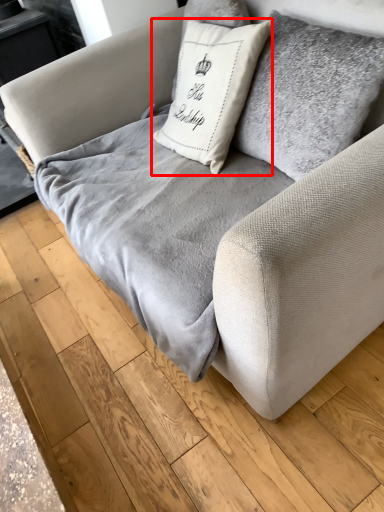
Question: From the image, what is the correct spatial relationship of pillow (annotated by the red box) in relation to blanket?

Choices:
 (A) right
 (B) left

Answer: (A)